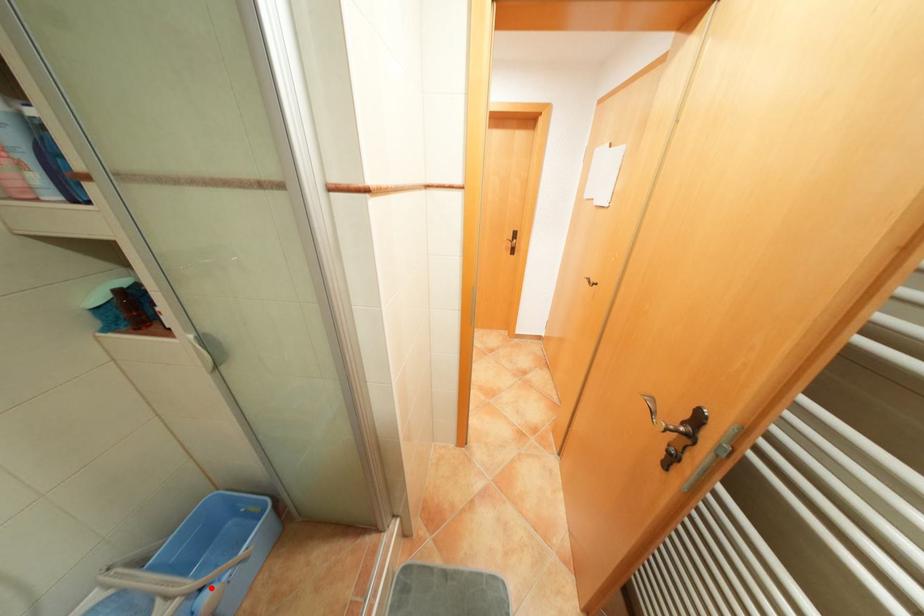
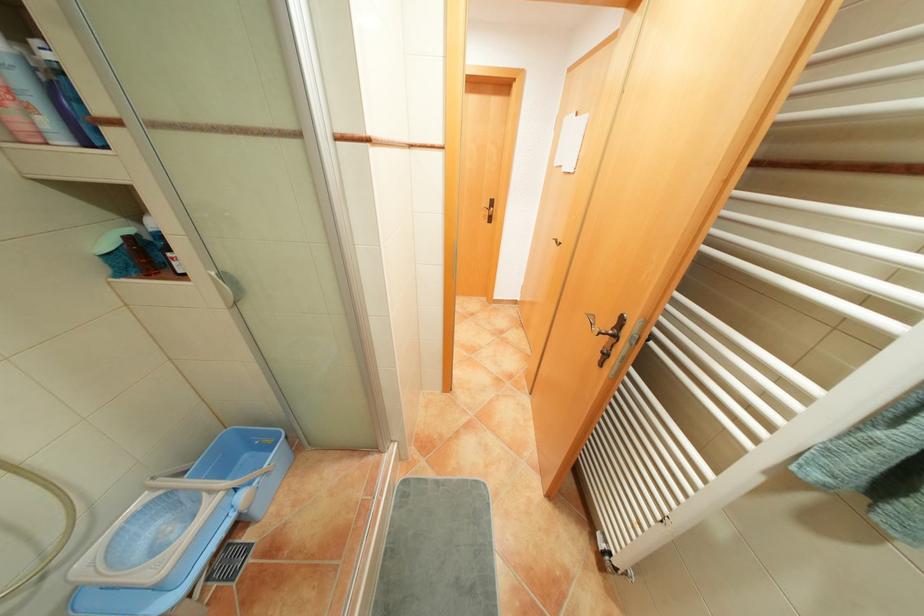
Question: I am providing you with two images of the same scene from different viewpoints. In image1, a red point is highlighted. Considering the same 3D point in image2, which of the following is correct?

Choices:
 (A) It is closer
 (B) It is farther

Answer: (B)